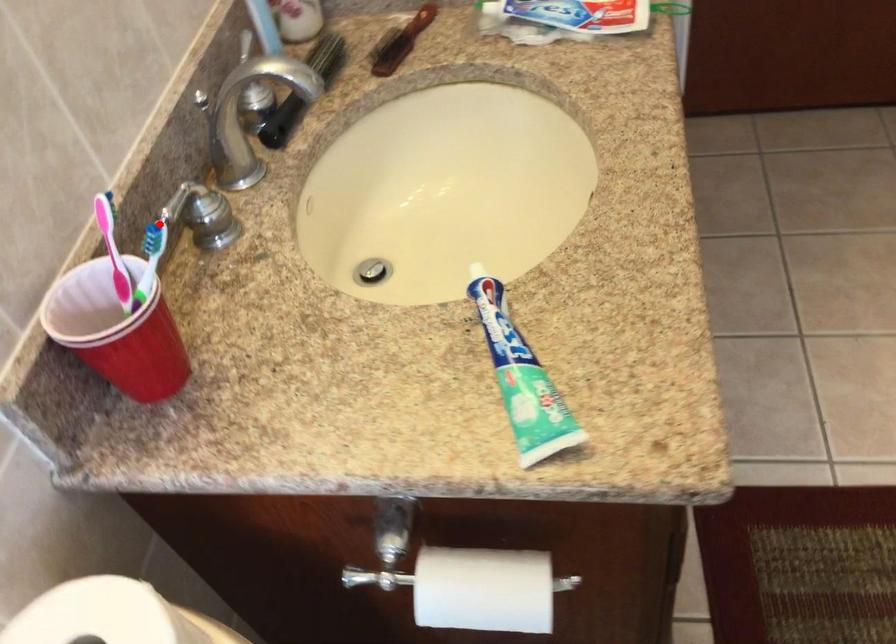
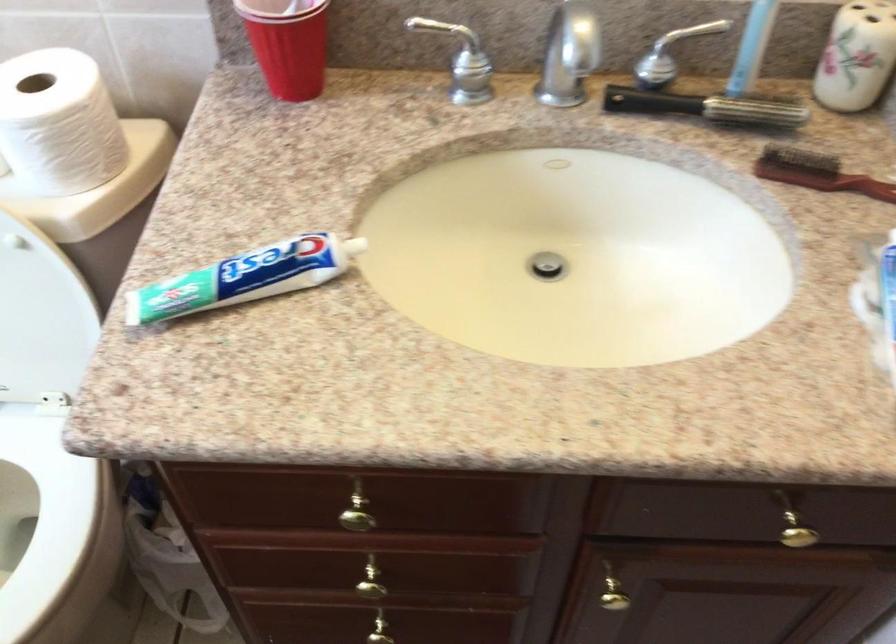
Question: A red point is marked in image1. In image2, is the corresponding 3D point closer to the camera or farther? Reply with the corresponding letter.

Choices:
 (A) The corresponding 3D point is closer.
 (B) The corresponding 3D point is farther.

Answer: (B)